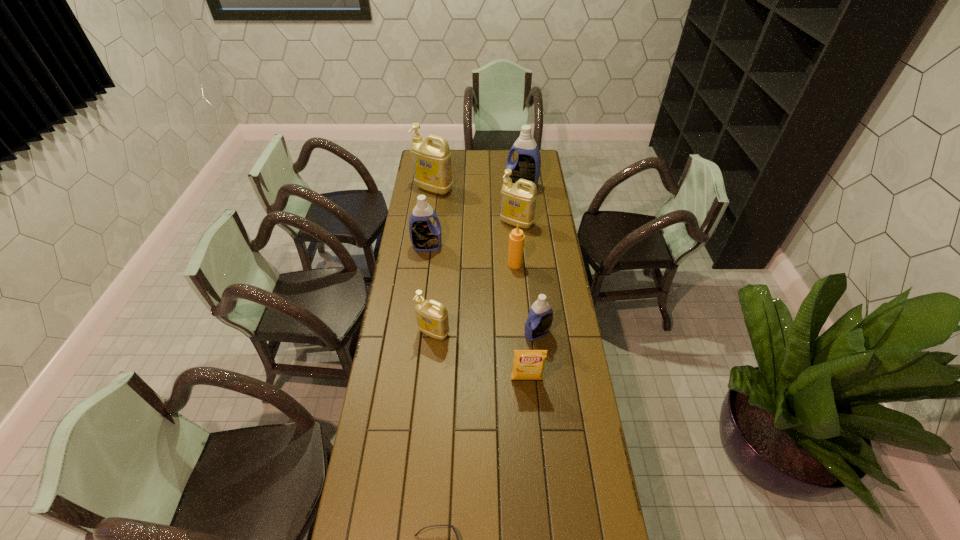
In order to click on crisp (potato chip) at the right edge in this screenshot , I will do `click(528, 364)`.

Where is `vacant space at the far edge`? The height and width of the screenshot is (540, 960). vacant space at the far edge is located at coordinates (487, 153).

In the image, there is a desktop. What are the coordinates of `free region at the left edge` in the screenshot? It's located at [408, 347].

This screenshot has height=540, width=960. Identify the location of vacant space at the right edge. (547, 342).

You are a GUI agent. You are given a task and a screenshot of the screen. Output one action in this format:
    pyautogui.click(x=<x>, y=<y>)
    Task: Click on the vacant region between the farthest blue detergent and the second nearest blue detergent
    
    Given the screenshot: What is the action you would take?
    pyautogui.click(x=474, y=217)

You are a GUI agent. You are given a task and a screenshot of the screen. Output one action in this format:
    pyautogui.click(x=<x>, y=<y>)
    Task: Click on the free space between the nearest blue detergent and the tan condiment
    
    Given the screenshot: What is the action you would take?
    pyautogui.click(x=526, y=299)

Locate an element on the screen. free space between the fourth nearest detergent and the smallest beige detergent is located at coordinates (475, 278).

This screenshot has height=540, width=960. In order to click on free point between the smallest blue detergent and the farthest beige detergent in this screenshot , I will do `click(486, 261)`.

This screenshot has width=960, height=540. In order to click on vacant area between the third nearest detergent and the crisp (potato chip) in this screenshot , I will do `click(477, 313)`.

Locate an element on the screen. The height and width of the screenshot is (540, 960). empty location between the fourth nearest detergent and the second nearest object is located at coordinates (522, 301).